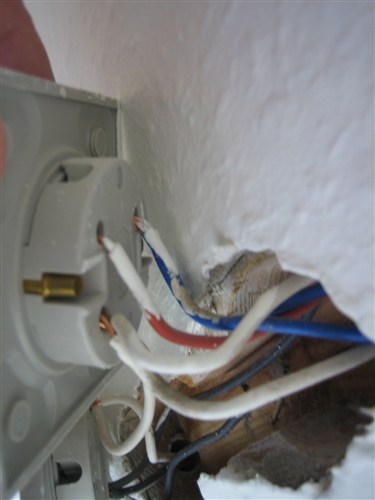
This screenshot has width=375, height=500. What are the coordinates of `rough white wall` in the screenshot? It's located at (287, 92).